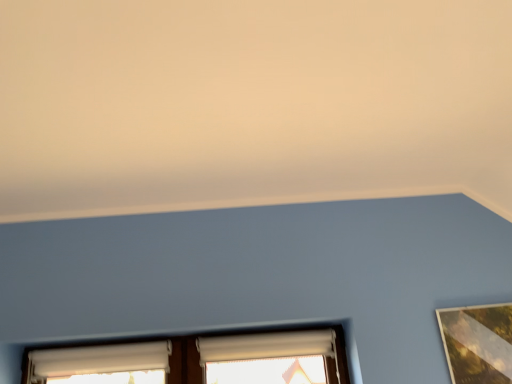
Question: Is white matte window at lower left, placed as the second window when sorted from right to left, next to white fabric window at center, which is the 2th window in left-to-right order?

Choices:
 (A) yes
 (B) no

Answer: (B)

Question: Is white matte window at lower left, placed as the second window when sorted from right to left, outside white fabric window at center, marked as the 1th window in a right-to-left arrangement?

Choices:
 (A) yes
 (B) no

Answer: (A)

Question: From the image's perspective, would you say white matte window at lower left, which is counted as the first window, starting from the left, is positioned over white fabric window at center, which is the 2th window in left-to-right order?

Choices:
 (A) no
 (B) yes

Answer: (A)

Question: Can you confirm if white matte window at lower left, placed as the second window when sorted from right to left, is shorter than white fabric window at center, which is the 2th window in left-to-right order?

Choices:
 (A) yes
 (B) no

Answer: (B)

Question: From a real-world perspective, does white matte window at lower left, which is counted as the first window, starting from the left, sit lower than white fabric window at center, which is the 2th window in left-to-right order?

Choices:
 (A) yes
 (B) no

Answer: (A)

Question: Considering the relative positions of white matte window at lower left, which is counted as the first window, starting from the left, and white fabric window at center, marked as the 1th window in a right-to-left arrangement, in the image provided, is white matte window at lower left, which is counted as the first window, starting from the left, to the left of white fabric window at center, marked as the 1th window in a right-to-left arrangement, from the viewer's perspective?

Choices:
 (A) yes
 (B) no

Answer: (A)

Question: Considering the relative sizes of white fabric window at center, which is the 2th window in left-to-right order, and white matte window at lower left, placed as the second window when sorted from right to left, in the image provided, is white fabric window at center, which is the 2th window in left-to-right order, smaller than white matte window at lower left, placed as the second window when sorted from right to left,?

Choices:
 (A) no
 (B) yes

Answer: (B)

Question: From a real-world perspective, is white fabric window at center, which is the 2th window in left-to-right order, beneath white matte window at lower left, placed as the second window when sorted from right to left?

Choices:
 (A) no
 (B) yes

Answer: (A)

Question: Is white fabric window at center, which is the 2th window in left-to-right order, shorter than white matte window at lower left, which is counted as the first window, starting from the left?

Choices:
 (A) no
 (B) yes

Answer: (B)

Question: Would you say white fabric window at center, which is the 2th window in left-to-right order, is a long distance from white matte window at lower left, which is counted as the first window, starting from the left?

Choices:
 (A) no
 (B) yes

Answer: (A)

Question: From a real-world perspective, is white fabric window at center, marked as the 1th window in a right-to-left arrangement, physically above white matte window at lower left, which is counted as the first window, starting from the left?

Choices:
 (A) yes
 (B) no

Answer: (A)

Question: Is white fabric window at center, which is the 2th window in left-to-right order, aimed at white matte window at lower left, placed as the second window when sorted from right to left?

Choices:
 (A) no
 (B) yes

Answer: (A)

Question: Considering the relative positions of white matte window at lower left, which is counted as the first window, starting from the left, and white fabric window at center, marked as the 1th window in a right-to-left arrangement, in the image provided, is white matte window at lower left, which is counted as the first window, starting from the left, to the left or to the right of white fabric window at center, marked as the 1th window in a right-to-left arrangement,?

Choices:
 (A) right
 (B) left

Answer: (B)